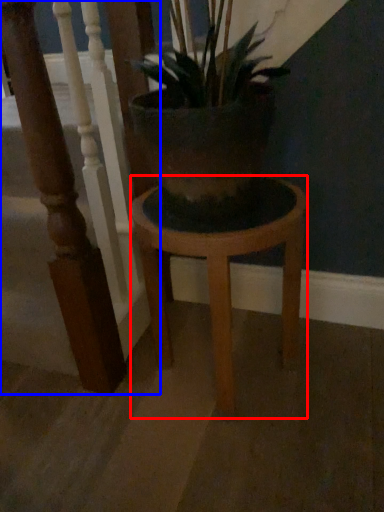
Question: Which point is closer to the camera, stool (highlighted by a red box) or rail (highlighted by a blue box)?

Choices:
 (A) stool
 (B) rail

Answer: (B)